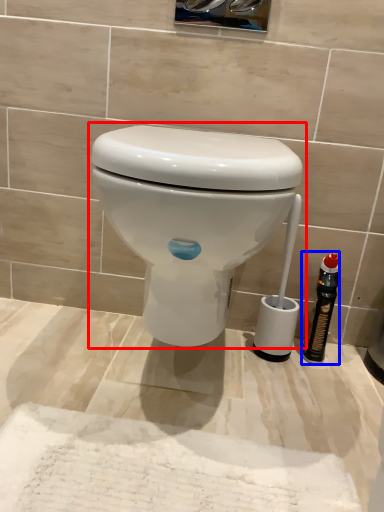
Question: Which object is further to the camera taking this photo, toilet (highlighted by a red box) or bottle (highlighted by a blue box)?

Choices:
 (A) toilet
 (B) bottle

Answer: (B)